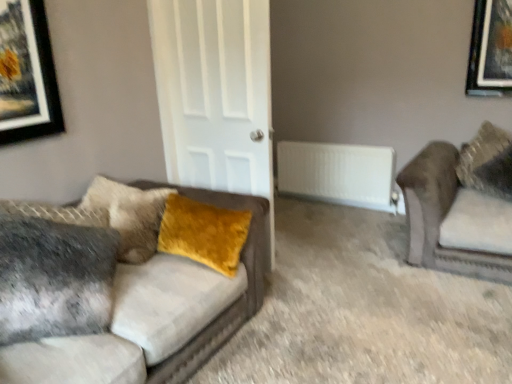
Question: In terms of size, does white plastic radiator at center appear bigger or smaller than velvet brown couch at right, the first studio couch in the right-to-left sequence?

Choices:
 (A) small
 (B) big

Answer: (A)

Question: Is white plastic radiator at center wider or thinner than velvet brown couch at right, which is the 2th studio couch from left to right?

Choices:
 (A) thin
 (B) wide

Answer: (A)

Question: Estimate the real-world distances between objects in this image. Which object is closer to the velvet brown couch at right, which is the 2th studio couch from left to right?

Choices:
 (A) white matte door at center
 (B) velvet mustard pillow at left, the second pillow positioned from the right
 (C) velvet yellow pillow at upper right, the 1th pillow when ordered from back to front
 (D) velvet gray couch at left, the second studio couch when ordered from right to left
 (E) white plastic radiator at center

Answer: (C)

Question: Based on their relative distances, which object is farther from the white matte door at center?

Choices:
 (A) velvet gray couch at left, the second studio couch when ordered from right to left
 (B) white plastic radiator at center
 (C) velvet mustard pillow at left, the 1th pillow in the front-to-back sequence
 (D) velvet brown couch at right, the first studio couch in the right-to-left sequence
 (E) velvet yellow pillow at upper right, which is the second pillow in front-to-back order

Answer: (E)